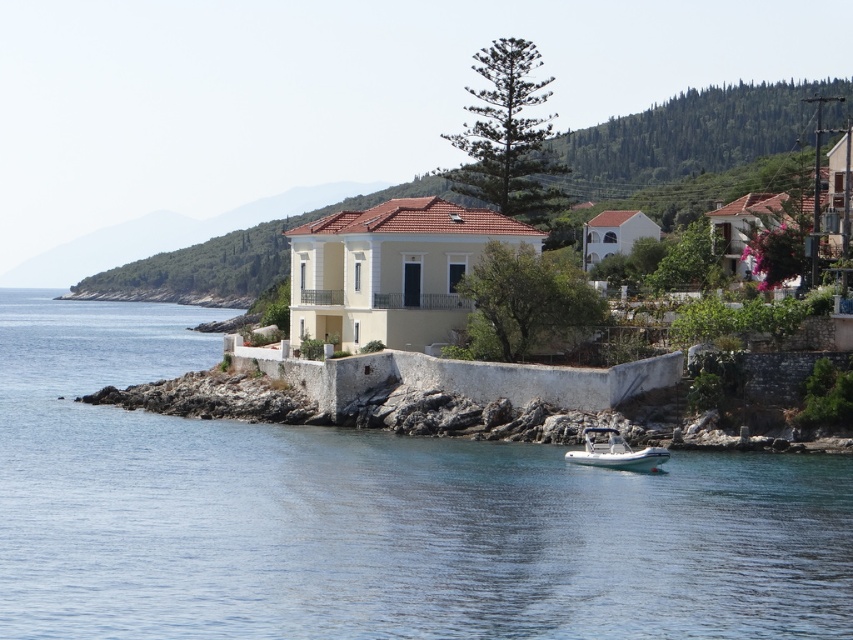
Is green leafy hillside at upper center further to the viewer compared to white rubber boat at lower center?

Yes, green leafy hillside at upper center is behind white rubber boat at lower center.

Can you confirm if green leafy hillside at upper center is wider than white rubber boat at lower center?

Yes.

Is point (642, 154) behind point (613, 429)?

That is True.

This screenshot has height=640, width=853. I want to click on green leafy hillside at upper center, so click(x=692, y=140).

Which of these two, clear blue water at center or green leafy hillside at upper center, stands taller?

green leafy hillside at upper center

Describe the element at coordinates (370, 516) in the screenshot. I see `clear blue water at center` at that location.

I want to click on clear blue water at center, so click(x=370, y=516).

This screenshot has height=640, width=853. Identify the location of clear blue water at center. (370, 516).

Consider the image. Does clear blue water at center come behind white rubber boat at lower center?

No, clear blue water at center is closer to the viewer.

Where is `clear blue water at center`? The image size is (853, 640). clear blue water at center is located at coordinates (370, 516).